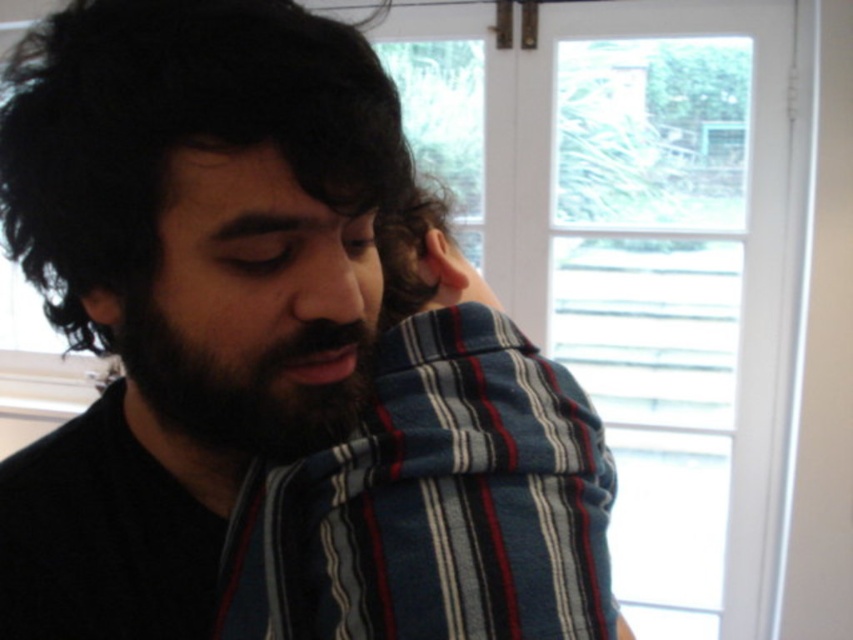
You are an artist trying to sketch this person. The dark curly hair at upper left is at point [175,129]. Where should you start drawing the dark curly hair at upper left on your canvas?

The dark curly hair at upper left is located at point [175,129], so you should start drawing the dark curly hair at upper left at that coordinate on your canvas.

From the picture: You are an artist trying to sketch this person. Which object is larger in size between the dark curly hair at upper left and the dark brown fuzzy beard at center?

The dark curly hair at upper left is bigger than the dark brown fuzzy beard at center.

You are an artist trying to sketch this person. You need to determine the spatial relationship between the dark curly hair at upper left and the dark brown fuzzy beard at center. Which object is positioned higher in the image?

The dark curly hair at upper left is positioned higher than the dark brown fuzzy beard at center because it is located above it.